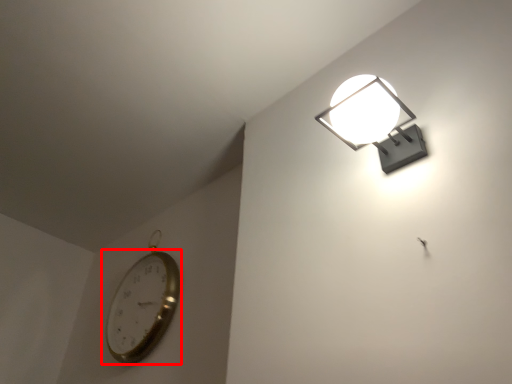
Question: From the image's perspective, where is wall clock (annotated by the red box) located in relation to lamp in the image?

Choices:
 (A) below
 (B) above

Answer: (A)